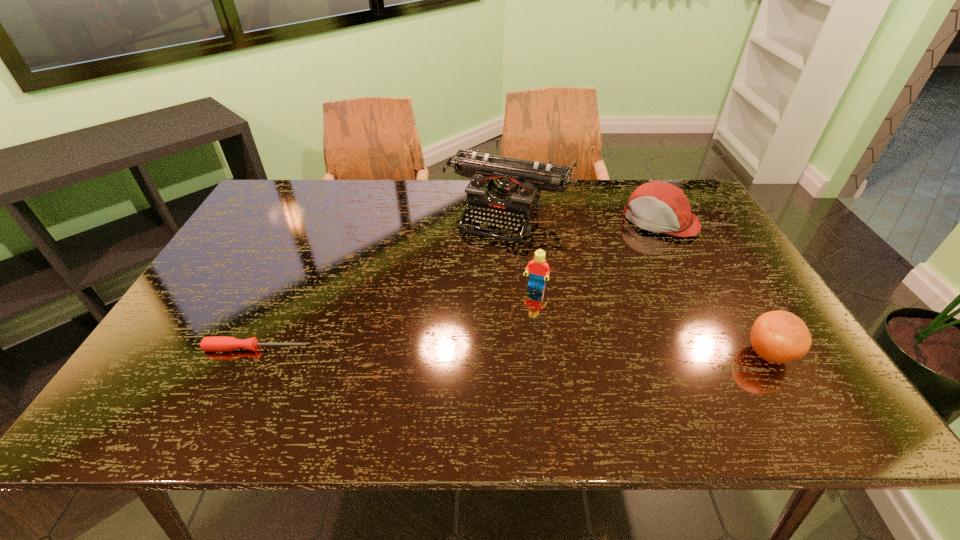
This screenshot has height=540, width=960. What are the coordinates of `orange situated at the near edge` in the screenshot? It's located at (778, 337).

The width and height of the screenshot is (960, 540). I want to click on object situated at the left edge, so click(x=217, y=343).

I want to click on orange situated at the right edge, so click(778, 337).

Where is `cap at the right edge`? Image resolution: width=960 pixels, height=540 pixels. cap at the right edge is located at coordinates (660, 207).

Locate an element on the screen. The image size is (960, 540). object that is at the near left corner is located at coordinates (217, 343).

This screenshot has width=960, height=540. I want to click on object located at the far right corner, so click(660, 207).

Locate an element on the screen. The image size is (960, 540). object at the near right corner is located at coordinates (778, 337).

I want to click on vacant region at the far edge of the desktop, so click(x=458, y=185).

The width and height of the screenshot is (960, 540). In the image, there is a desktop. What are the coordinates of `blank space at the left edge` in the screenshot? It's located at pos(196,301).

Locate an element on the screen. The height and width of the screenshot is (540, 960). free space at the right edge is located at coordinates pyautogui.click(x=744, y=268).